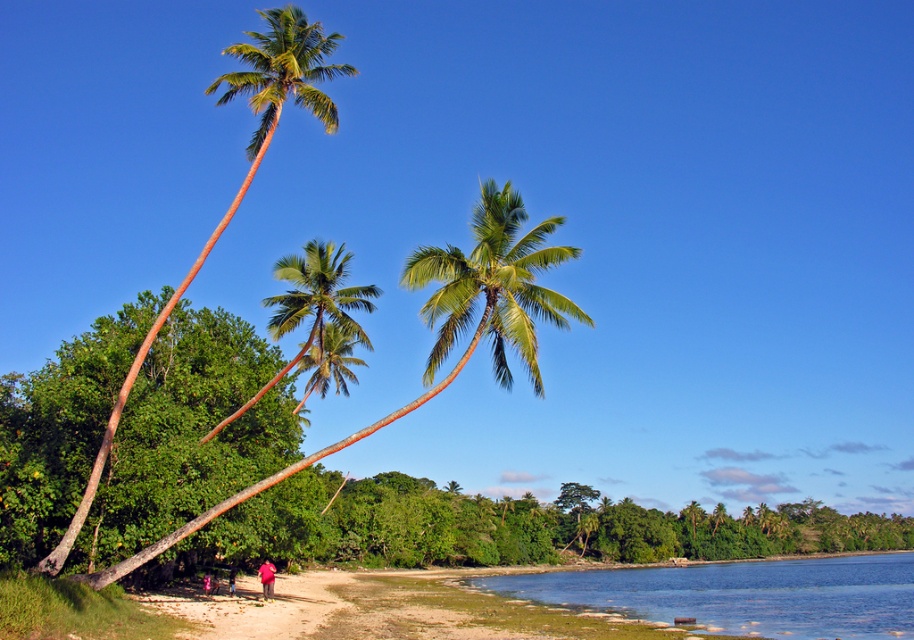
Question: Does blue water at lower center appear on the right side of red cotton shirt at lower center?

Choices:
 (A) yes
 (B) no

Answer: (A)

Question: From the image, what is the correct spatial relationship of green leafy palm tree at left in relation to red cotton shirt at lower center?

Choices:
 (A) above
 (B) below

Answer: (A)

Question: Which of the following is the closest to the observer?

Choices:
 (A) red cotton shirt at lower center
 (B) blue water at lower center

Answer: (B)

Question: Estimate the real-world distances between objects in this image. Which object is closer to the green leafy palm tree at left?

Choices:
 (A) red cotton shirt at lower center
 (B) blue water at lower center

Answer: (B)

Question: Does blue water at lower center appear over green leafy palm tree at left?

Choices:
 (A) yes
 (B) no

Answer: (B)

Question: Among these points, which one is nearest to the camera?

Choices:
 (A) [x=267, y=16]
 (B) [x=264, y=589]
 (C) [x=793, y=589]

Answer: (A)